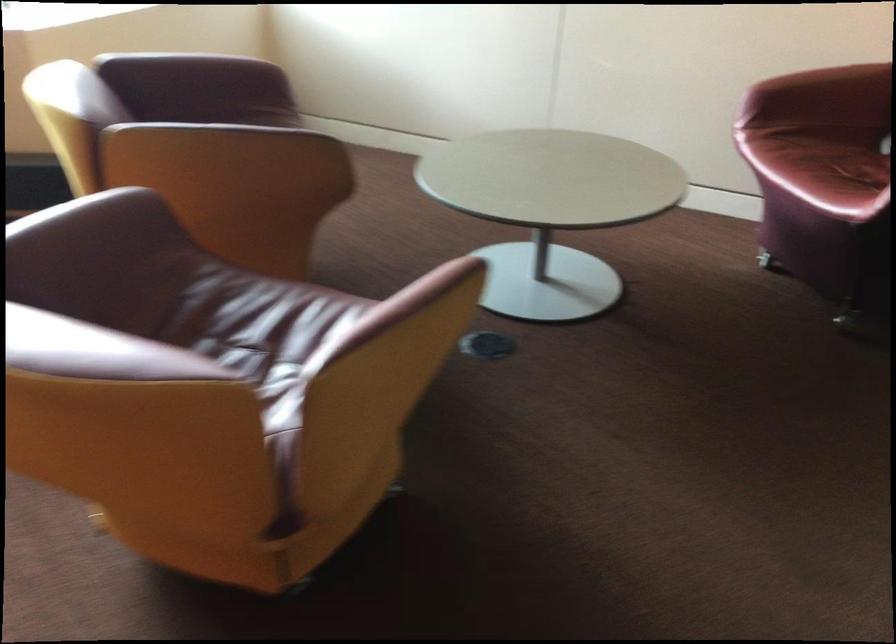
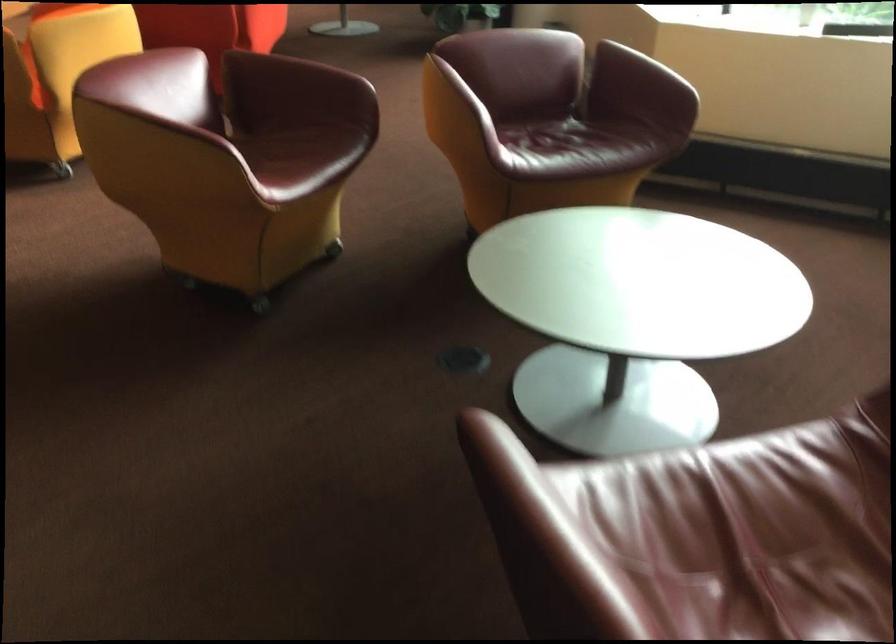
In the second image, find the point that corresponds to the point at 138,333 in the first image.

(289, 146)